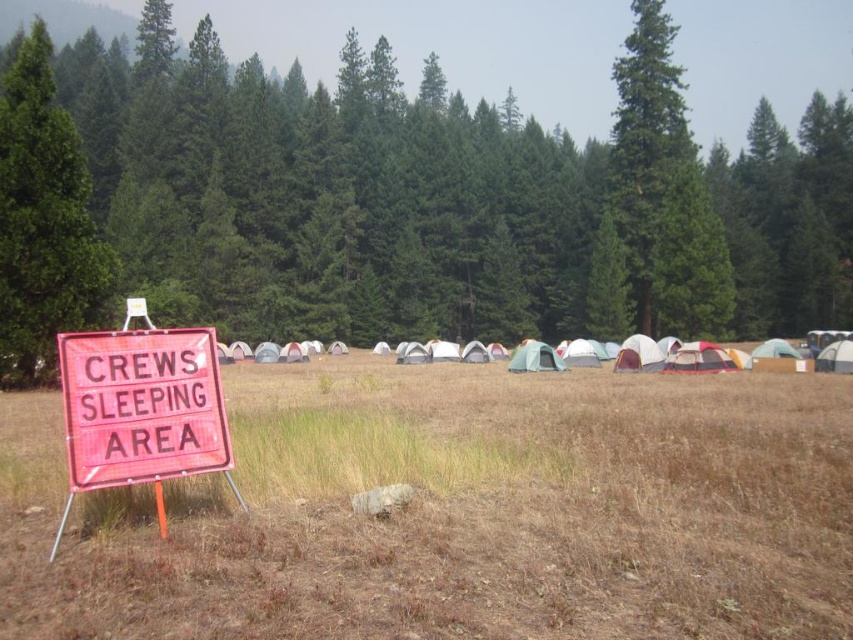
You are a camper who just arrived at the campsite. You see a green matte tree at center and a white fabric tent at center. Which object is higher up in the image?

The green matte tree at center is located above the white fabric tent at center, so it is higher up in the image.

You are a hiker who just arrived at the campsite and want to set up your tent. You notice the brown dry grass at center and the white fabric tents at center. Which area should you avoid placing your tent to prevent damage to the grass?

You should avoid placing your tent in the brown dry grass at center because it is in front of the white fabric tents at center, which means the grass is closer to the tents and might be trampled or damaged during tent setup.

You are a campsite manager planning to set up a new fire pit. The fire pit requires a safety zone of at least 60 feet from any flammable materials. Given the distance between the brown dry grass at center and the white fabric tents at center, is this location suitable for the fire pit?

The distance between the brown dry grass at center and the white fabric tents at center is 58.22 feet, which is less than the required 60 feet safety zone. Therefore, this location is not suitable for the fire pit.